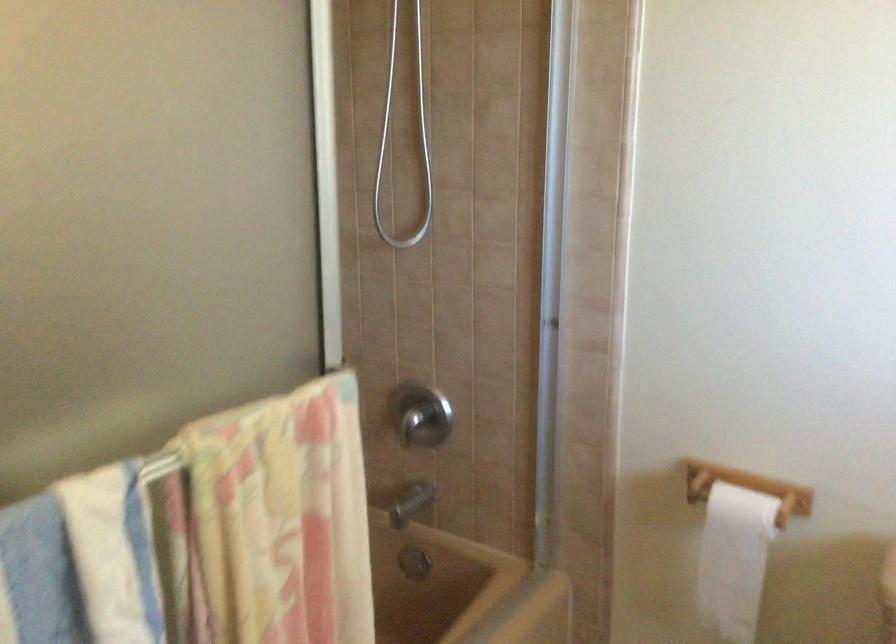
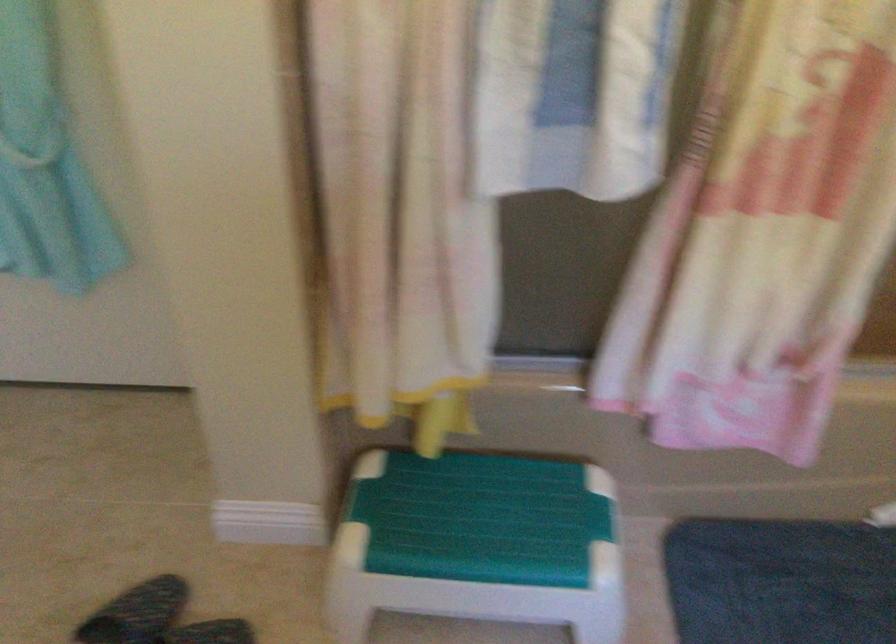
How did the camera likely rotate?

The camera's rotation is toward left-down.